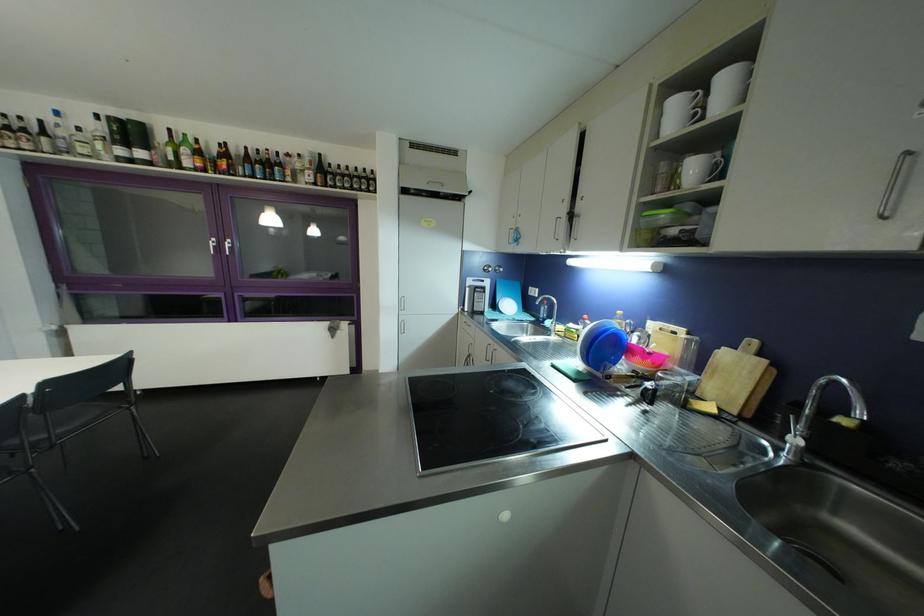
What are the coordinates of `silver cabinet handle` in the screenshot? It's located at (227, 246).